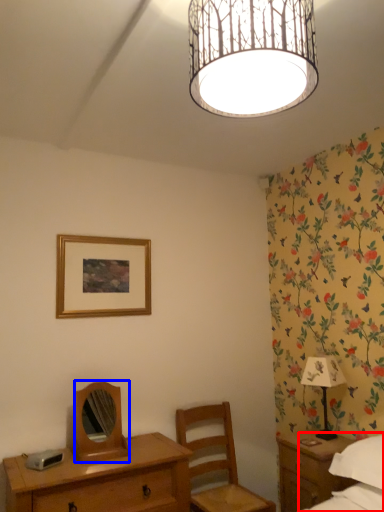
Question: Among these objects, which one is nearest to the camera, bed (highlighted by a red box) or mirror (highlighted by a blue box)?

Choices:
 (A) bed
 (B) mirror

Answer: (A)